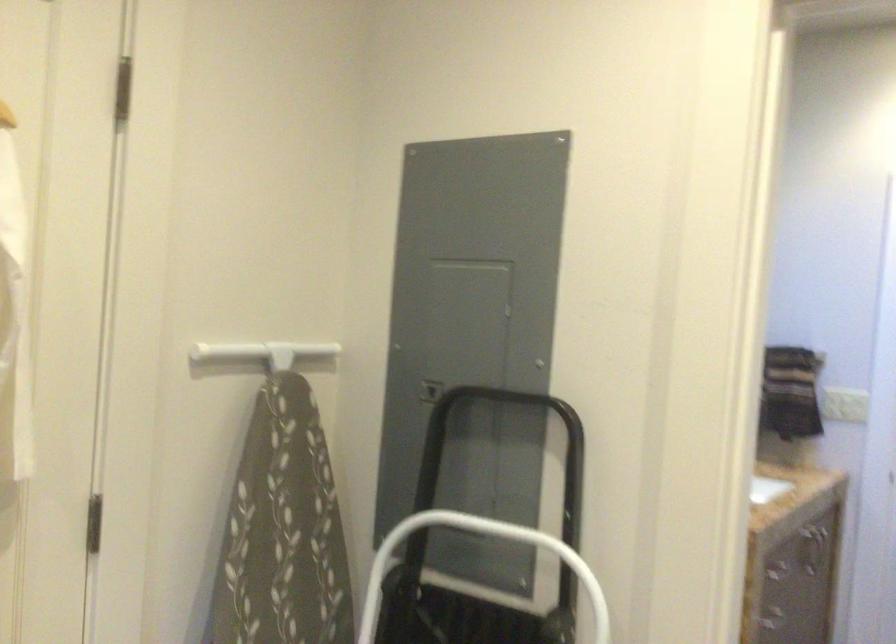
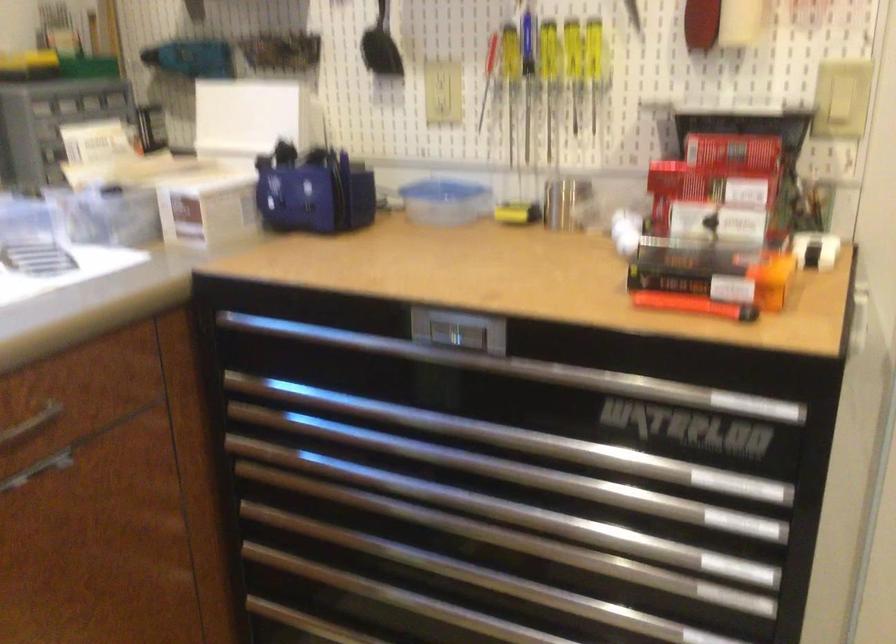
How did the camera likely rotate?

The camera's rotation is toward left-down.